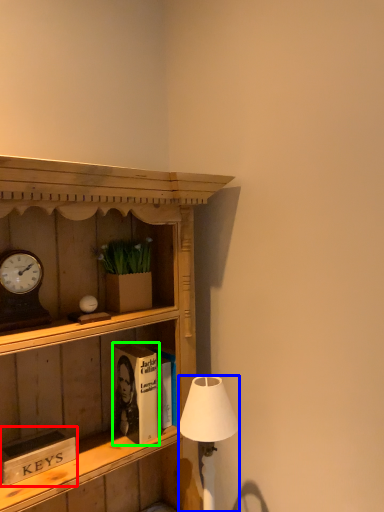
Question: Which object is positioned closest to book (highlighted by a red box)? Select from lamp (highlighted by a blue box) and book (highlighted by a green box).

Choices:
 (A) lamp
 (B) book

Answer: (B)